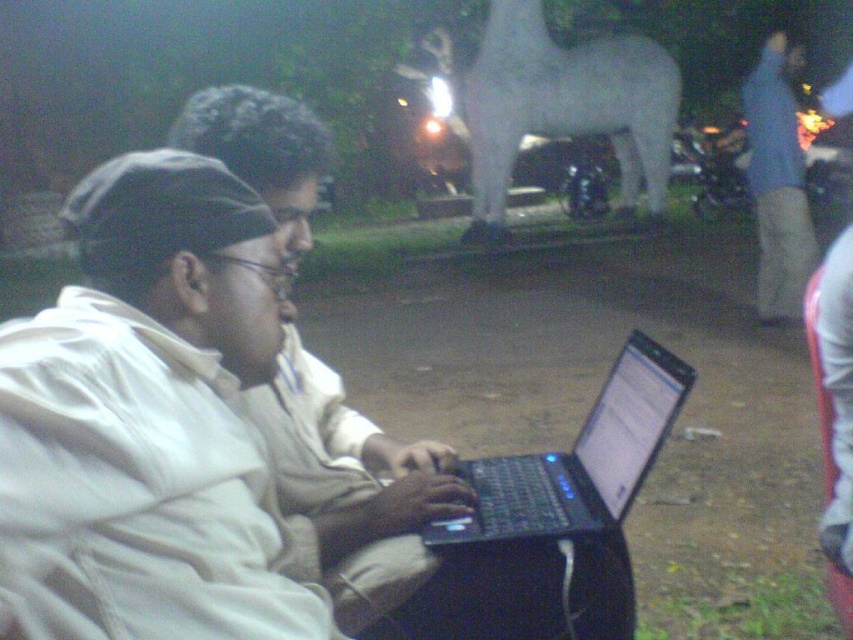
You are a photographer trying to capture a clear shot of the white matte jacket at center and the white matte laptop at center. Since both are at the same central position, which object will appear smaller in the photo?

The white matte jacket at center will appear smaller in the photo because it has a lesser height compared to the white matte laptop at center.

You are a photographer trying to capture a clear photo of the black plastic laptop at center and the blue jeans at right. Since you want both subjects in focus, you need to adjust your camera settings. Which object should you focus on to ensure both are sharp?

You should focus on the black plastic laptop at center because it is closer to the viewer than the blue jeans at right. By focusing on the closer object, the depth of field will extend further back, potentially keeping both in focus.